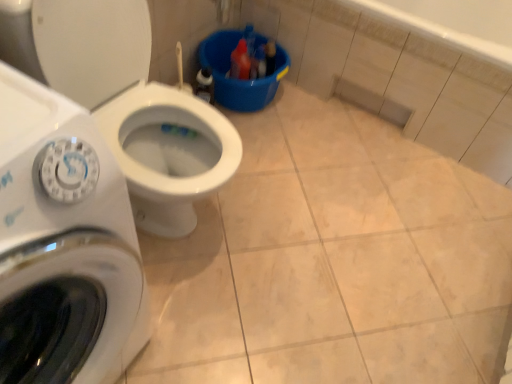
Question: Is white glossy washing machine at left in front of or behind white glossy toilet at center-left in the image?

Choices:
 (A) behind
 (B) front

Answer: (B)

Question: Visually, is white glossy washing machine at left positioned to the left or to the right of white glossy toilet at center-left?

Choices:
 (A) left
 (B) right

Answer: (A)

Question: Would you say white glossy washing machine at left is inside or outside white glossy toilet at center-left?

Choices:
 (A) inside
 (B) outside

Answer: (B)

Question: From a real-world perspective, is white glossy toilet at center-left positioned above or below white glossy washing machine at left?

Choices:
 (A) below
 (B) above

Answer: (A)

Question: In terms of width, does white glossy toilet at center-left look wider or thinner when compared to white glossy washing machine at left?

Choices:
 (A) wide
 (B) thin

Answer: (A)

Question: Is point (157, 130) positioned closer to the camera than point (74, 213)?

Choices:
 (A) farther
 (B) closer

Answer: (A)

Question: Is white glossy toilet at center-left spatially inside white glossy washing machine at left, or outside of it?

Choices:
 (A) inside
 (B) outside

Answer: (B)